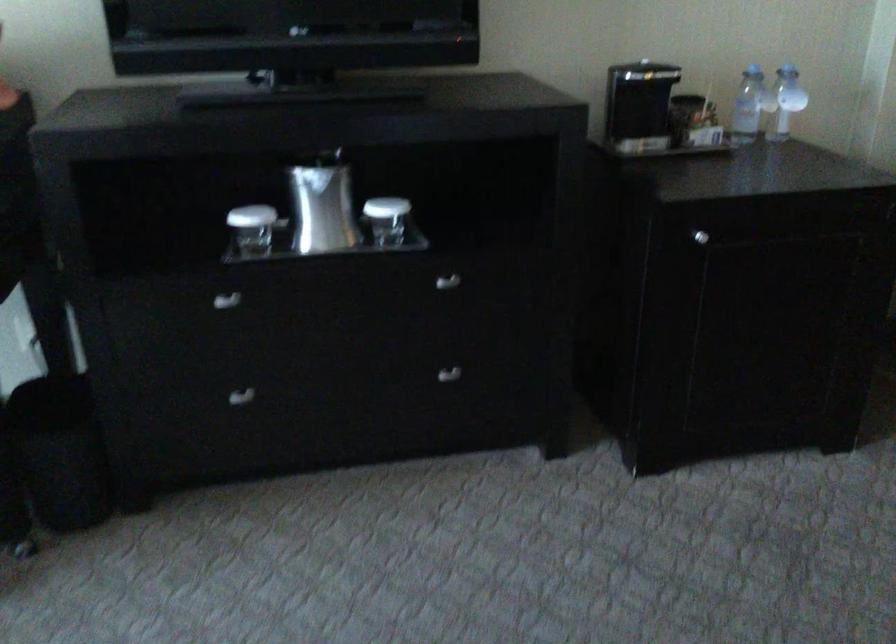
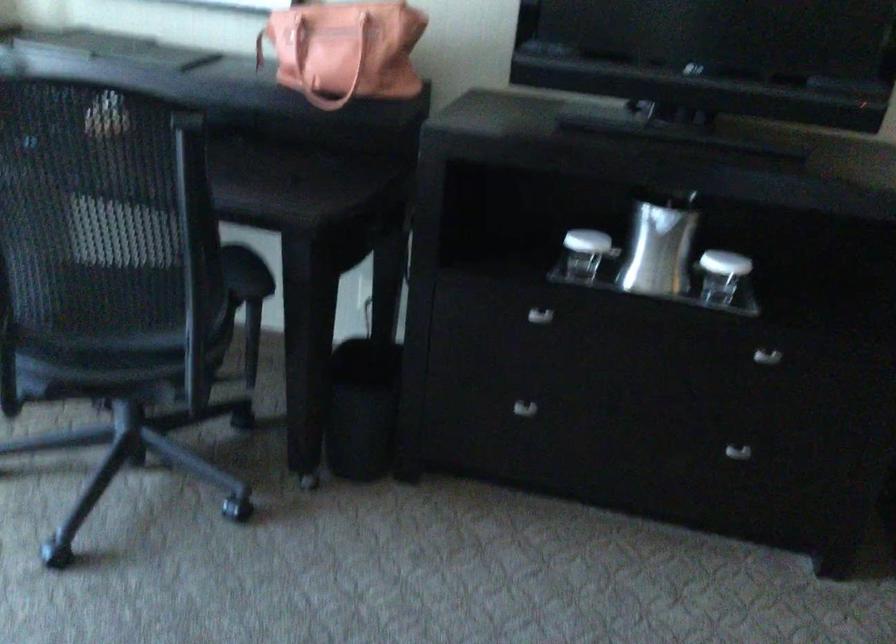
Question: What movement of the cameraman would produce the second image?

Choices:
 (A) Left
 (B) Right
 (C) Forward
 (D) Backward

Answer: (A)